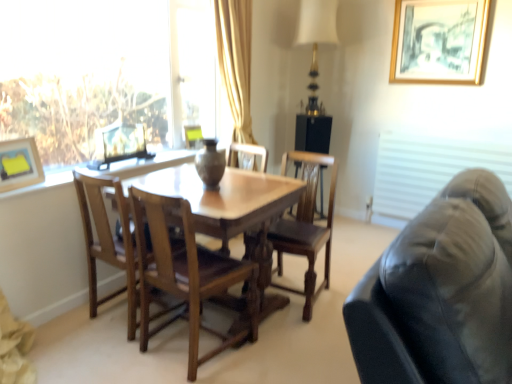
Question: Should I look upward or downward to see wooden chair at center, the first chair positioned from the right?

Choices:
 (A) down
 (B) up

Answer: (A)

Question: Is transparent glass window at upper left aimed at wooden chair at center, which appears as the 2th chair when viewed from the right?

Choices:
 (A) yes
 (B) no

Answer: (A)

Question: Can you confirm if transparent glass window at upper left is smaller than wooden chair at center, the 2th chair when ordered from left to right?

Choices:
 (A) no
 (B) yes

Answer: (A)

Question: From a real-world perspective, is transparent glass window at upper left over wooden chair at center, which appears as the 2th chair when viewed from the right?

Choices:
 (A) yes
 (B) no

Answer: (A)

Question: From the image's perspective, does transparent glass window at upper left appear lower than wooden chair at center, the 2th chair when ordered from left to right?

Choices:
 (A) no
 (B) yes

Answer: (A)

Question: Does transparent glass window at upper left have a lesser height compared to wooden chair at center, which appears as the 2th chair when viewed from the right?

Choices:
 (A) yes
 (B) no

Answer: (B)

Question: Is the depth of transparent glass window at upper left less than that of wooden chair at center, the 2th chair when ordered from left to right?

Choices:
 (A) no
 (B) yes

Answer: (A)

Question: Can you confirm if matte yellow picture frame at center, the 2th picture frame from the right, is thinner than wooden chair at center, the first chair positioned from the right?

Choices:
 (A) yes
 (B) no

Answer: (A)

Question: Is matte yellow picture frame at center, the 3th picture frame in the front-to-back sequence, far from wooden chair at center, the first chair positioned from the right?

Choices:
 (A) yes
 (B) no

Answer: (A)

Question: From a real-world perspective, is matte yellow picture frame at center, the 3th picture frame in the front-to-back sequence, physically below wooden chair at center, placed as the third chair when sorted from left to right?

Choices:
 (A) yes
 (B) no

Answer: (B)

Question: Does matte yellow picture frame at center, the 2th picture frame from the right, appear on the right side of wooden chair at center, the first chair positioned from the right?

Choices:
 (A) yes
 (B) no

Answer: (B)

Question: Can you confirm if matte yellow picture frame at center, arranged as the second picture frame when viewed from the top, is smaller than wooden chair at center, the first chair positioned from the right?

Choices:
 (A) yes
 (B) no

Answer: (A)

Question: Is matte yellow picture frame at center, the 3th picture frame in the front-to-back sequence, further to camera compared to wooden chair at center, the first chair positioned from the right?

Choices:
 (A) no
 (B) yes

Answer: (B)

Question: Is matte yellow picture frame at upper left, the first picture frame in the front-to-back sequence, outside of transparent glass window at upper left?

Choices:
 (A) no
 (B) yes

Answer: (B)